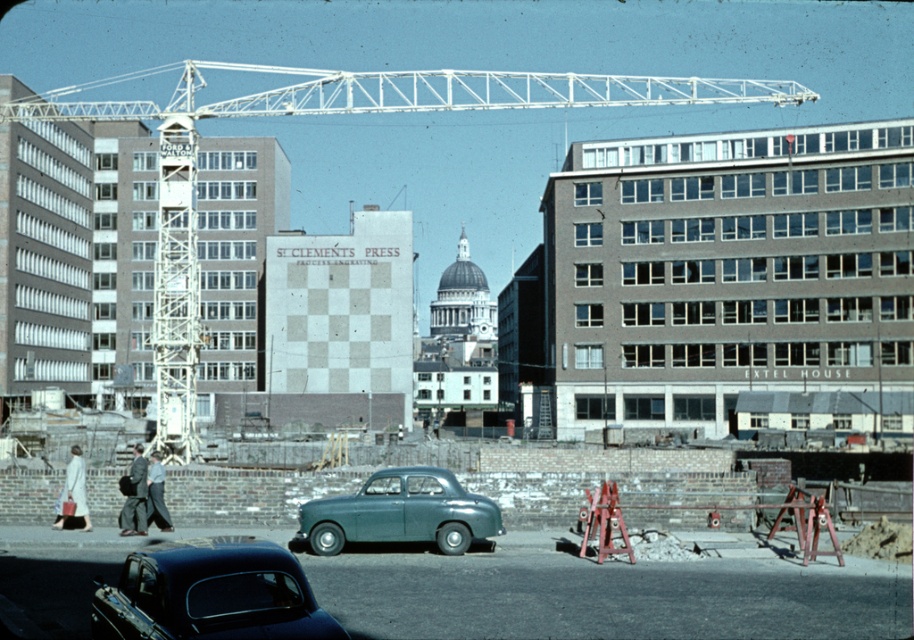
Can you confirm if white metal crane at upper center is positioned to the right of shiny black car at center?

No, white metal crane at upper center is not to the right of shiny black car at center.

You are a GUI agent. You are given a task and a screenshot of the screen. Output one action in this format:
    pyautogui.click(x=<x>, y=<y>)
    Task: Click on the white metal crane at upper center
    
    Given the screenshot: What is the action you would take?
    [x=325, y=113]

The image size is (914, 640). In order to click on white metal crane at upper center in this screenshot , I will do `click(325, 113)`.

Identify the location of white metal crane at upper center. This screenshot has width=914, height=640. (325, 113).

Is point (175, 280) positioned in front of point (140, 486)?

No, (175, 280) is further to viewer.

Does white metal crane at upper center appear on the right side of dark gray suit at center?

No, white metal crane at upper center is not to the right of dark gray suit at center.

Between point (190, 406) and point (124, 506), which one is positioned behind?

Point (190, 406)

Image resolution: width=914 pixels, height=640 pixels. I want to click on white metal crane at upper center, so click(x=325, y=113).

Does teal matte sedan at center appear on the right side of dark gray suit at center?

Indeed, teal matte sedan at center is positioned on the right side of dark gray suit at center.

Does teal matte sedan at center have a greater height compared to dark gray suit at center?

Correct, teal matte sedan at center is much taller as dark gray suit at center.

Describe the element at coordinates (401, 513) in the screenshot. I see `teal matte sedan at center` at that location.

At what (x,y) coordinates should I click in order to perform the action: click on teal matte sedan at center. Please return your answer as a coordinate pair (x, y). Looking at the image, I should click on (401, 513).